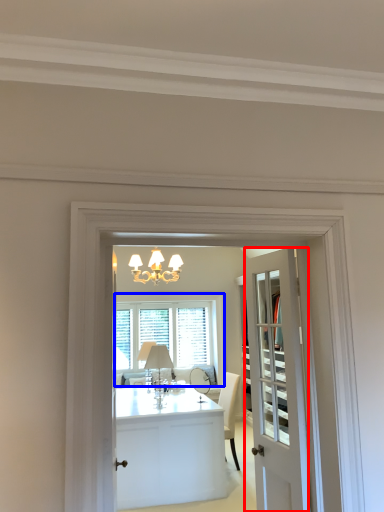
Question: Which point is further to the camera, door (highlighted by a red box) or window (highlighted by a blue box)?

Choices:
 (A) door
 (B) window

Answer: (B)